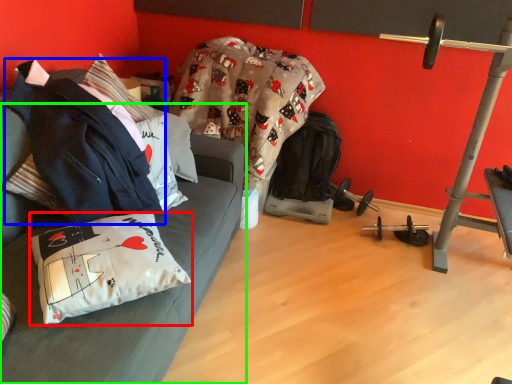
Question: Based on their relative distances, which object is farther from pillow (highlighted by a red box)? Choose from jacket (highlighted by a blue box) and studio couch (highlighted by a green box).

Choices:
 (A) jacket
 (B) studio couch

Answer: (A)